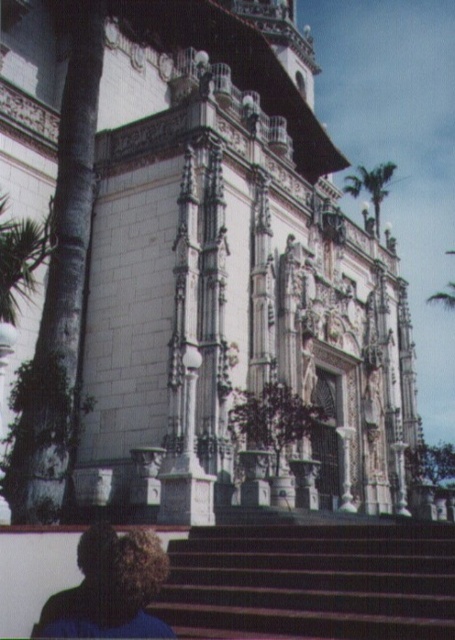
You are standing at the bottom of the brown wooden stairs at lower center and want to reach the green leafy palm tree at upper right. Which object is closer to you?

The brown wooden stairs at lower center is closer to you than the green leafy palm tree at upper right.

You are standing at the base of the brown wooden stairs at lower center and want to see the dark curly hair at lower left. Since the stairs are shorter than the hair, can you see over them?

The brown wooden stairs at lower center is not as tall as dark curly hair at lower left, so yes, you can see over the stairs to the dark curly hair at lower left.

You are a visitor standing at the bottom of the brown wooden stairs at lower center. You want to take a photo of the green leafy palm tree at upper right. Which direction should you tilt your camera to capture it?

Since the brown wooden stairs at lower center is not as tall as the green leafy palm tree at upper right, you should tilt your camera upwards to capture the green leafy palm tree at upper right.